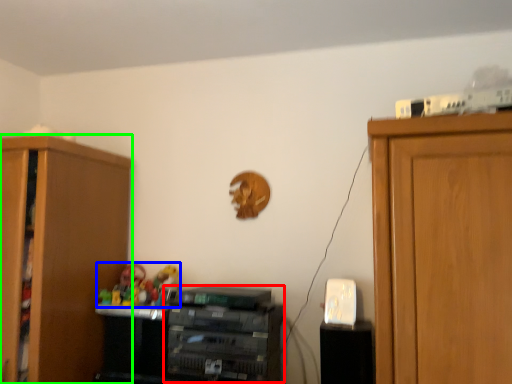
Question: Which is farther away from cabinetry (highlighted by a red box)? toy (highlighted by a blue box) or cabinetry (highlighted by a green box)?

Choices:
 (A) toy
 (B) cabinetry

Answer: (B)